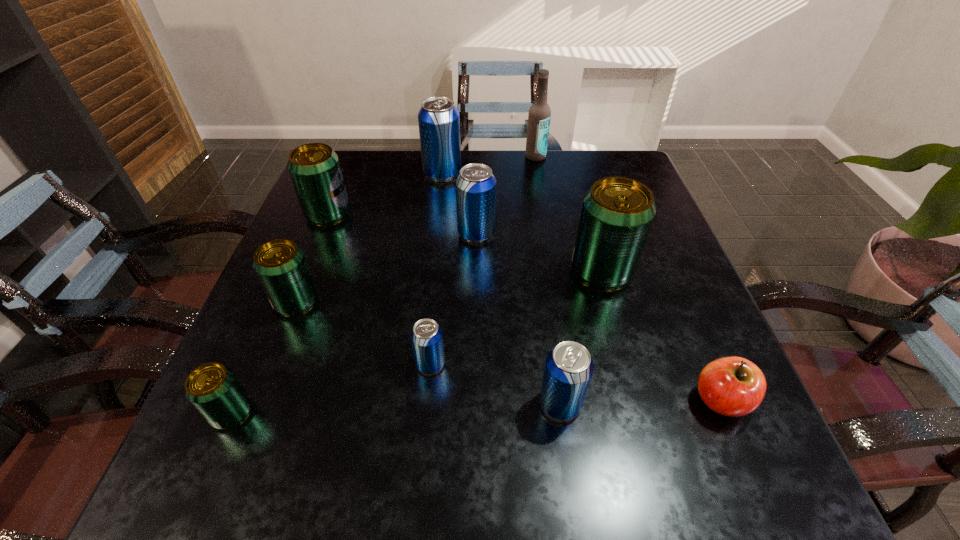
In the image, there is a desktop. Where is `free space at the near edge`? free space at the near edge is located at coordinates (348, 444).

In the image, there is a desktop. Where is `vacant space at the left edge`? Image resolution: width=960 pixels, height=540 pixels. vacant space at the left edge is located at coordinates (302, 352).

This screenshot has width=960, height=540. What are the coordinates of `blank space at the right edge of the desktop` in the screenshot? It's located at (644, 284).

In order to click on free space at the far left corner in this screenshot , I will do `click(380, 151)`.

Where is `vacant position at the near left corner of the desktop`? The height and width of the screenshot is (540, 960). vacant position at the near left corner of the desktop is located at coordinates point(181,479).

Where is `vacant space at the far right corner`? The image size is (960, 540). vacant space at the far right corner is located at coordinates (617, 175).

At what (x,y) coordinates should I click in order to perform the action: click on free region at the near right corner of the desktop. Please return your answer as a coordinate pair (x, y). The image size is (960, 540). Looking at the image, I should click on (744, 457).

The width and height of the screenshot is (960, 540). Identify the location of vacant space in between the rightmost beer can and the second farthest blue beer can. (539, 252).

Find the location of `free space that is in between the third nearest beer can and the third smallest blue beer can`. free space that is in between the third nearest beer can and the third smallest blue beer can is located at coordinates (453, 299).

Identify the location of free spot between the second smallest blue beer can and the biggest blue beer can. This screenshot has width=960, height=540. (501, 288).